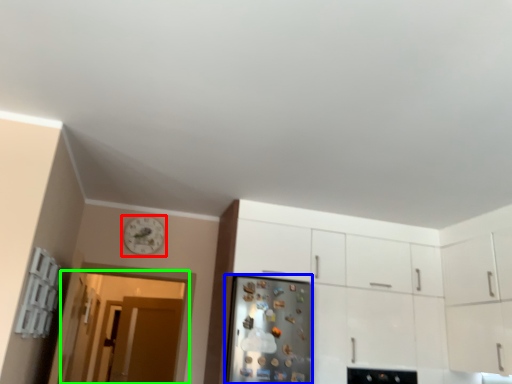
Question: Which object is positioned closest to clock (highlighted by a red box)? Select from fridge (highlighted by a blue box) and glass door (highlighted by a green box).

Choices:
 (A) fridge
 (B) glass door

Answer: (B)